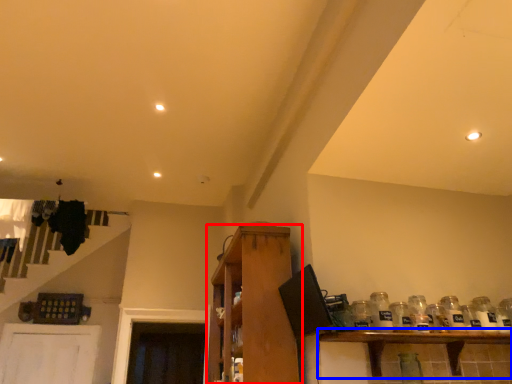
Question: Which point is closer to the camera, shelf (highlighted by a red box) or shelf (highlighted by a blue box)?

Choices:
 (A) shelf
 (B) shelf

Answer: (B)